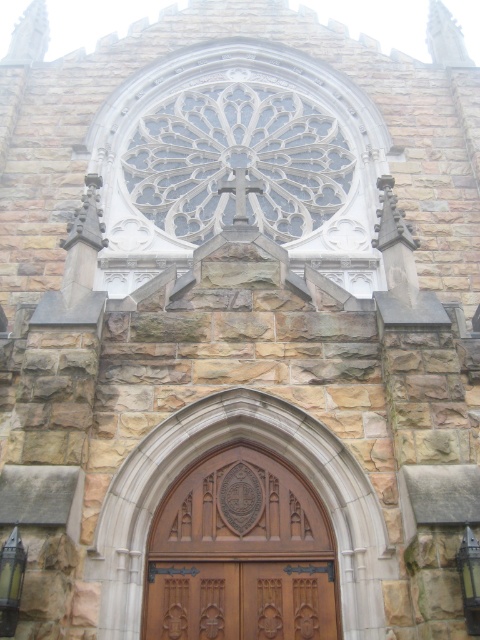
Is brown wood door at center bigger than brown wooden door at center?

Correct, brown wood door at center is larger in size than brown wooden door at center.

Is point (181, 586) farther from viewer compared to point (319, 637)?

Yes, point (181, 586) is behind point (319, 637).

Does point (288, 570) come farther from viewer compared to point (260, 570)?

Yes, point (288, 570) is farther from viewer.

Find the location of `brown wood door at center`. brown wood door at center is located at coordinates (240, 554).

The height and width of the screenshot is (640, 480). I want to click on brown wood door at center, so click(240, 554).

Find the location of `brown wood door at center`. brown wood door at center is located at coordinates (240, 554).

Does point (165, 156) lie in front of point (225, 596)?

No, it is not.

Who is more forward, (215, 124) or (280, 609)?

Point (280, 609) is more forward.

Does point (148, 116) come in front of point (292, 616)?

No, it is not.

Find the location of a particular element. The height and width of the screenshot is (640, 480). clear glass cross at upper center is located at coordinates (238, 161).